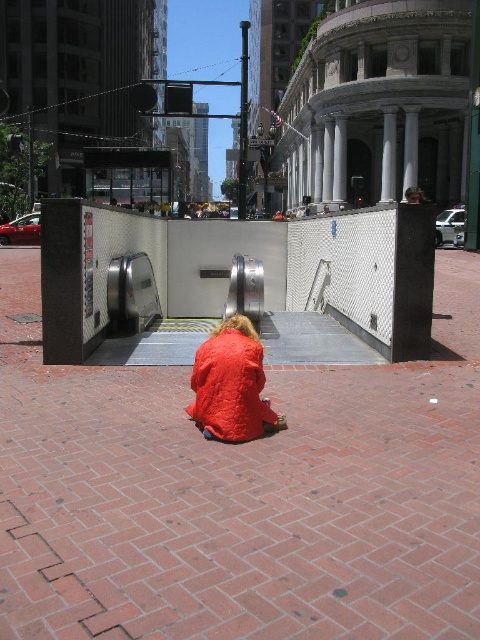
Question: Does brick pavement at center have a smaller size compared to quilted orange coat at center?

Choices:
 (A) yes
 (B) no

Answer: (B)

Question: Does brick pavement at center have a larger size compared to quilted orange coat at center?

Choices:
 (A) yes
 (B) no

Answer: (A)

Question: Where is brick pavement at center located in relation to quilted orange coat at center in the image?

Choices:
 (A) left
 (B) right

Answer: (B)